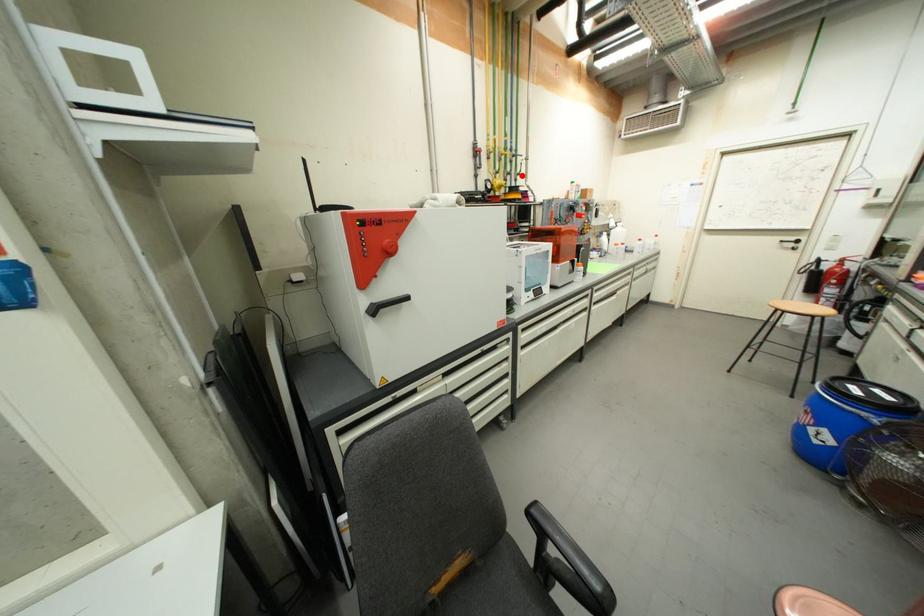
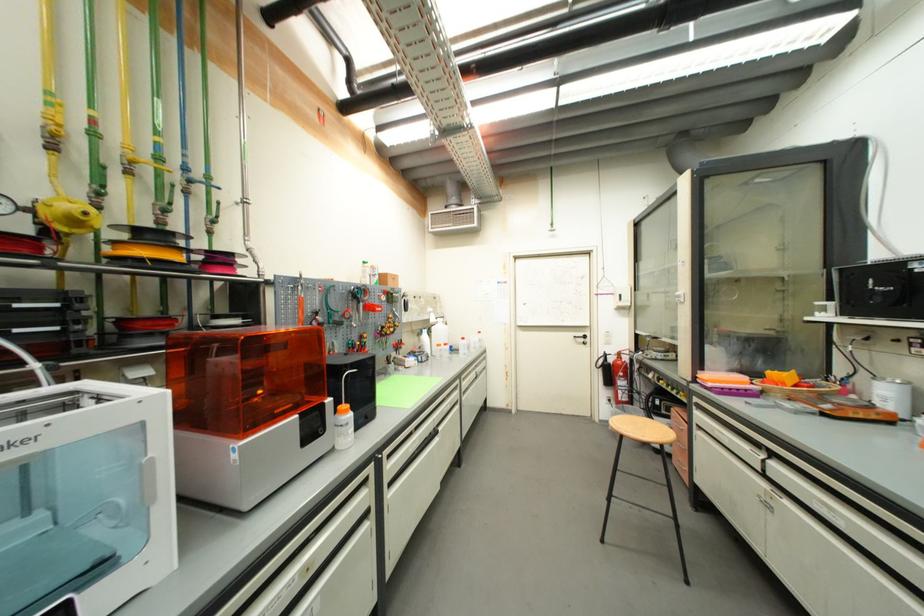
Question: I am providing you with two images of the same scene from different viewpoints. Image1 has a red point marked. In image2, the corresponding 3D location appears at what relative position? Reply with the corresponding letter.

Choices:
 (A) Closer
 (B) Farther

Answer: (B)